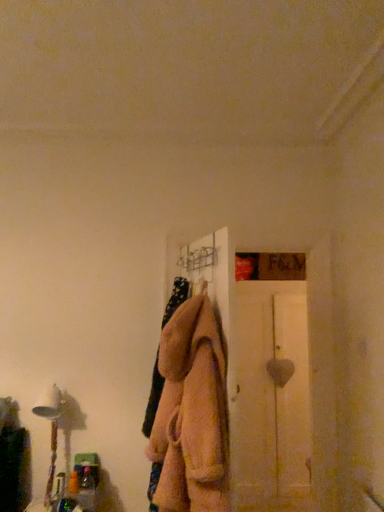
Question: Considering the relative sizes of white wooden door at right and white fabric lampshade at left in the image provided, is white wooden door at right bigger than white fabric lampshade at left?

Choices:
 (A) yes
 (B) no

Answer: (A)

Question: Are white wooden door at right and white fabric lampshade at left located far from each other?

Choices:
 (A) no
 (B) yes

Answer: (B)

Question: From the image's perspective, is white wooden door at right under white fabric lampshade at left?

Choices:
 (A) no
 (B) yes

Answer: (B)

Question: Considering the relative sizes of white wooden door at right and white fabric lampshade at left in the image provided, is white wooden door at right thinner than white fabric lampshade at left?

Choices:
 (A) no
 (B) yes

Answer: (A)

Question: Is white wooden door at right behind white fabric lampshade at left?

Choices:
 (A) no
 (B) yes

Answer: (B)

Question: From a real-world perspective, is fuzzy beige coat at center positioned above or below white wooden door at right?

Choices:
 (A) above
 (B) below

Answer: (A)

Question: From the image's perspective, is fuzzy beige coat at center above or below white wooden door at right?

Choices:
 (A) above
 (B) below

Answer: (A)

Question: Is fuzzy beige coat at center to the left or to the right of white wooden door at right in the image?

Choices:
 (A) right
 (B) left

Answer: (B)

Question: Relative to white wooden door at right, is fuzzy beige coat at center in front or behind?

Choices:
 (A) front
 (B) behind

Answer: (A)

Question: Is white wooden door at right bigger or smaller than fuzzy beige coat at center?

Choices:
 (A) big
 (B) small

Answer: (A)

Question: Considering the positions of white wooden door at right and fuzzy beige coat at center in the image, is white wooden door at right taller or shorter than fuzzy beige coat at center?

Choices:
 (A) short
 (B) tall

Answer: (B)

Question: From the image's perspective, relative to fuzzy beige coat at center, is white wooden door at right above or below?

Choices:
 (A) below
 (B) above

Answer: (A)

Question: Looking at their shapes, would you say white wooden door at right is wider or thinner than fuzzy beige coat at center?

Choices:
 (A) thin
 (B) wide

Answer: (B)

Question: In the image, is white fabric lampshade at left positioned in front of or behind white wooden door at right?

Choices:
 (A) front
 (B) behind

Answer: (A)

Question: In terms of size, does white fabric lampshade at left appear bigger or smaller than white wooden door at right?

Choices:
 (A) big
 (B) small

Answer: (B)